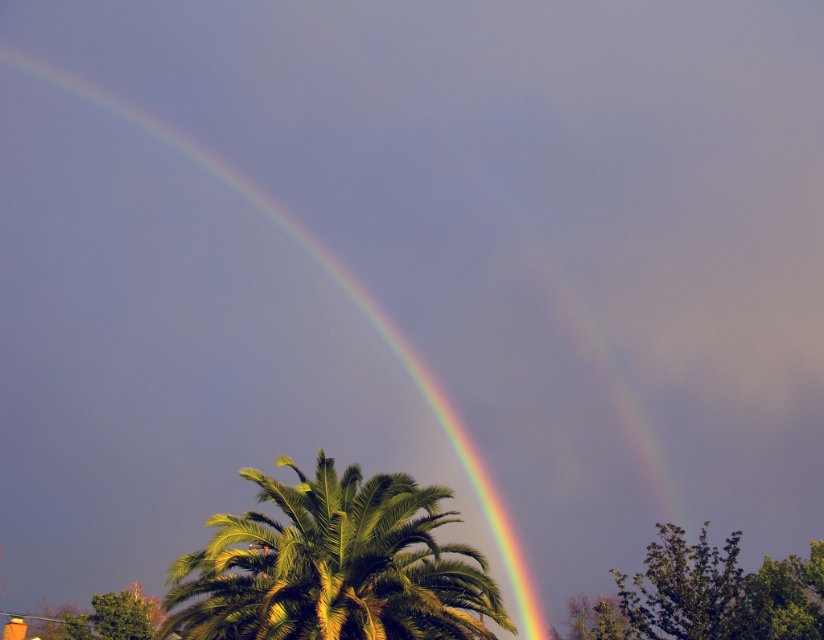
How much distance is there between green leafy palm tree at center and rainbow at upper center?

A distance of 257.45 feet exists between green leafy palm tree at center and rainbow at upper center.

Between green leafy palm tree at center and rainbow at upper center, which one appears on the right side from the viewer's perspective?

Positioned to the right is green leafy palm tree at center.

Does point (185, 620) come in front of point (455, 433)?

Yes, it is in front of point (455, 433).

In order to click on green leafy palm tree at center in this screenshot , I will do `click(335, 564)`.